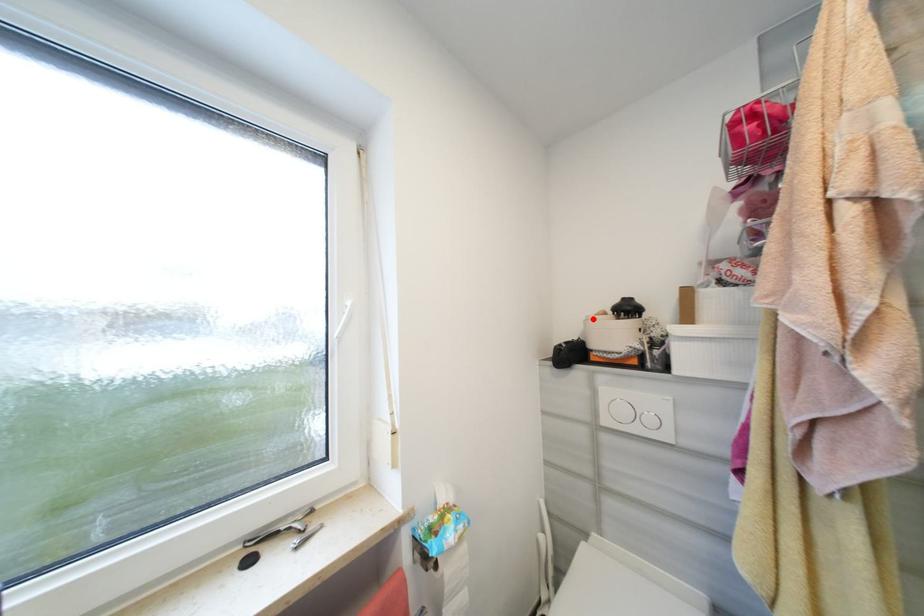
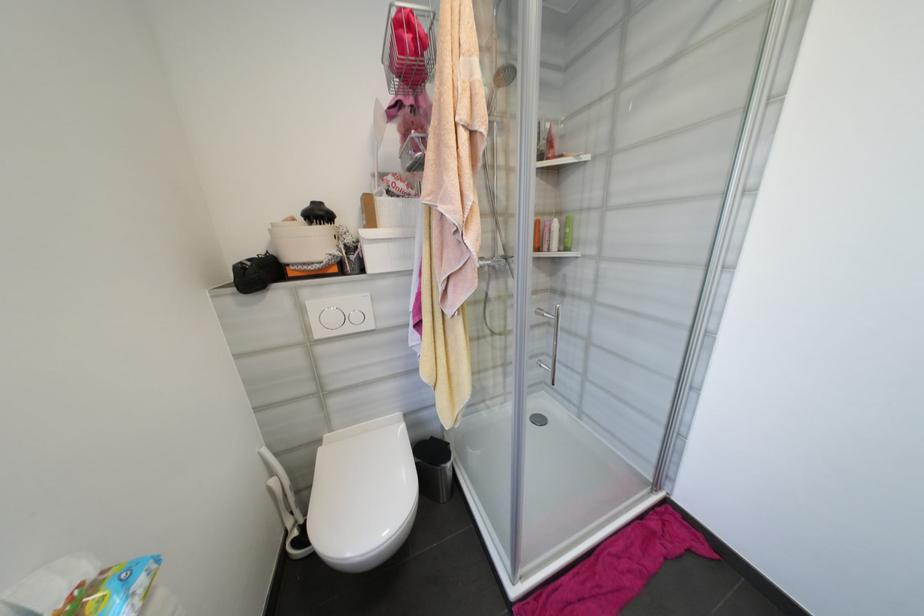
Find the pixel in the second image that matches the highlighted location in the first image.

(280, 225)